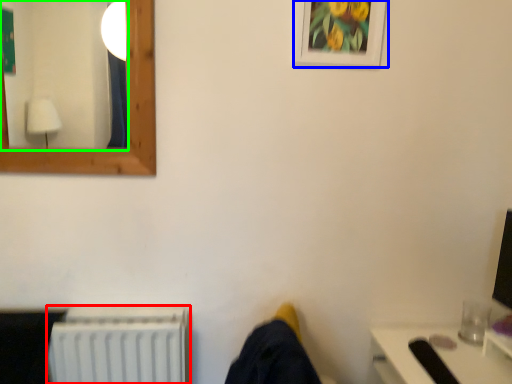
Question: Which object is the farthest from radiator (highlighted by a red box)? Choose among these: picture frame (highlighted by a blue box) or mirror (highlighted by a green box).

Choices:
 (A) picture frame
 (B) mirror

Answer: (B)